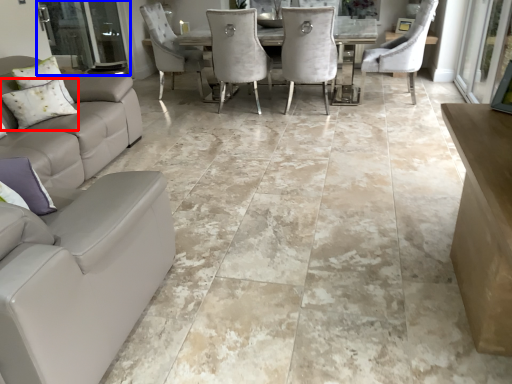
Question: Which point is closer to the camera, pillow (highlighted by a red box) or screen door (highlighted by a blue box)?

Choices:
 (A) pillow
 (B) screen door

Answer: (A)